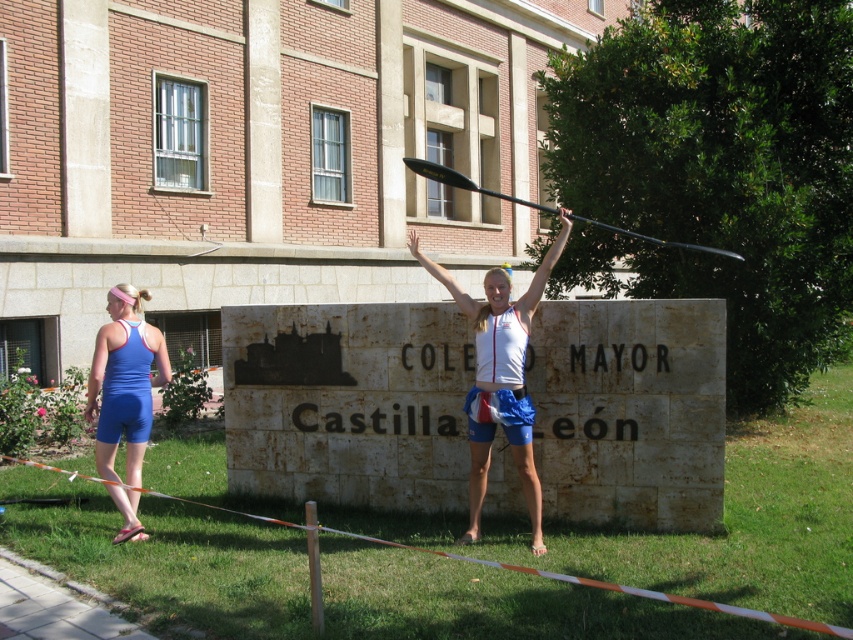
Can you confirm if blue fabric shorts at left is positioned to the left of pink fabric headband at upper left?

No, blue fabric shorts at left is not to the left of pink fabric headband at upper left.

Is blue fabric shorts at left taller than pink fabric headband at upper left?

Yes, blue fabric shorts at left is taller than pink fabric headband at upper left.

Does point (125, 401) lie behind point (132, 285)?

No, it is in front of (132, 285).

Identify the location of blue fabric shorts at left. This screenshot has height=640, width=853. (125, 381).

Between point (706, 252) and point (140, 308), which one is positioned in front?

Positioned in front is point (140, 308).

How much distance is there between black glossy paddle at upper center and pink fabric headband at upper left?

3.85 meters

At what (x,y) coordinates should I click in order to perform the action: click on black glossy paddle at upper center. Please return your answer as a coordinate pair (x, y). The width and height of the screenshot is (853, 640). Looking at the image, I should click on (463, 180).

Locate an element on the screen. Image resolution: width=853 pixels, height=640 pixels. black glossy paddle at upper center is located at coordinates (463, 180).

Is pink fabric headband at upper left shorter than blonde hair at center?

Indeed, pink fabric headband at upper left has a lesser height compared to blonde hair at center.

Which is above, pink fabric headband at upper left or blonde hair at center?

blonde hair at center

Between point (126, 308) and point (505, 264), which one is positioned behind?

The point (505, 264) is behind.

The image size is (853, 640). What are the coordinates of `pink fabric headband at upper left` in the screenshot? It's located at (126, 300).